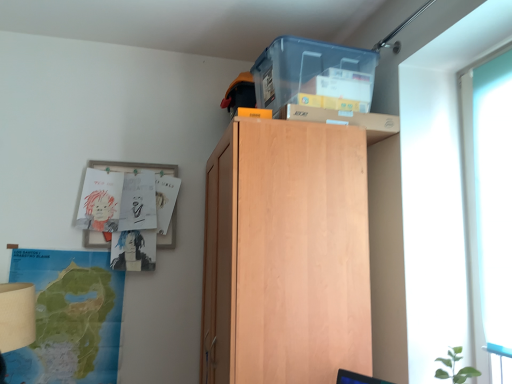
Question: Can you confirm if transparent plastic storage box at upper center is taller than light wood cabinet at upper center?

Choices:
 (A) yes
 (B) no

Answer: (B)

Question: Is light wood cabinet at upper center inside transparent plastic storage box at upper center?

Choices:
 (A) no
 (B) yes

Answer: (A)

Question: Is the position of transparent plastic storage box at upper center more distant than that of light wood cabinet at upper center?

Choices:
 (A) yes
 (B) no

Answer: (A)

Question: Considering the relative positions of transparent plastic storage box at upper center and light wood cabinet at upper center in the image provided, is transparent plastic storage box at upper center in front of light wood cabinet at upper center?

Choices:
 (A) no
 (B) yes

Answer: (A)

Question: Is transparent plastic storage box at upper center at the left side of light wood cabinet at upper center?

Choices:
 (A) yes
 (B) no

Answer: (B)

Question: From the image's perspective, is transparent plastic storage box at upper center on top of light wood cabinet at upper center?

Choices:
 (A) no
 (B) yes

Answer: (B)

Question: From the image's perspective, does transparent plastic storage box at upper center appear higher than transparent glass door at right?

Choices:
 (A) no
 (B) yes

Answer: (B)

Question: Considering the relative sizes of transparent plastic storage box at upper center and transparent glass door at right in the image provided, is transparent plastic storage box at upper center thinner than transparent glass door at right?

Choices:
 (A) no
 (B) yes

Answer: (A)

Question: From a real-world perspective, is transparent plastic storage box at upper center on top of transparent glass door at right?

Choices:
 (A) no
 (B) yes

Answer: (B)

Question: From a real-world perspective, is transparent plastic storage box at upper center under transparent glass door at right?

Choices:
 (A) yes
 (B) no

Answer: (B)

Question: Is transparent plastic storage box at upper center wider than transparent glass door at right?

Choices:
 (A) yes
 (B) no

Answer: (A)

Question: Considering the relative sizes of transparent plastic storage box at upper center and transparent glass door at right in the image provided, is transparent plastic storage box at upper center taller than transparent glass door at right?

Choices:
 (A) yes
 (B) no

Answer: (B)

Question: Is the position of light wood cabinet at upper center less distant than that of transparent glass door at right?

Choices:
 (A) yes
 (B) no

Answer: (B)